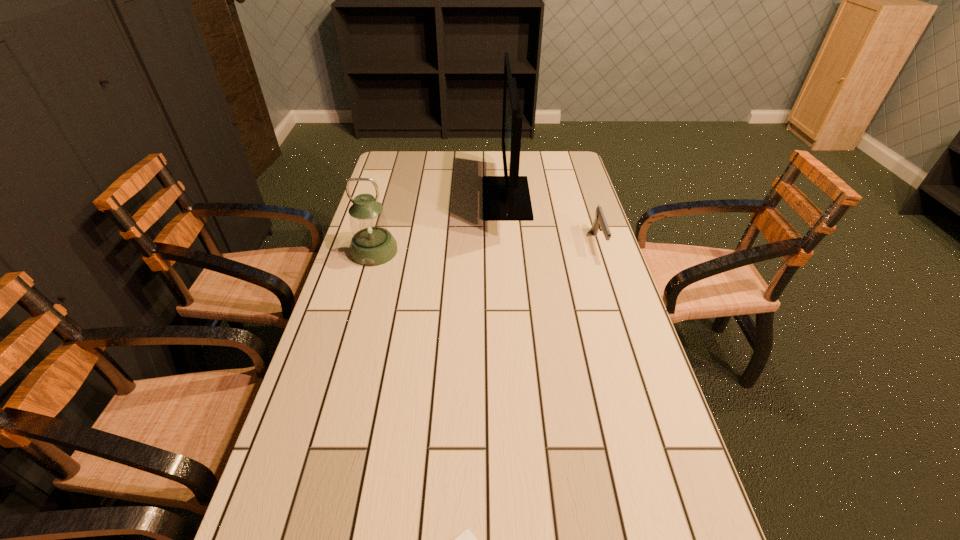
The height and width of the screenshot is (540, 960). I want to click on object that is positioned at the far edge, so click(505, 198).

The width and height of the screenshot is (960, 540). I want to click on object that is at the left edge, so point(372,244).

In order to click on object that is at the right edge in this screenshot , I will do `click(600, 223)`.

This screenshot has width=960, height=540. Identify the location of vacant space at the left edge of the desktop. (312, 504).

In the image, there is a desktop. Identify the location of vacant space at the right edge. The width and height of the screenshot is (960, 540). (561, 224).

This screenshot has height=540, width=960. In the image, there is a desktop. What are the coordinates of `blank space at the far left corner` in the screenshot? It's located at (395, 163).

Find the location of `vacant area at the far right corner`. vacant area at the far right corner is located at coordinates [x=544, y=154].

Where is `vacant space that's between the lantern and the rightmost object`? vacant space that's between the lantern and the rightmost object is located at coordinates (486, 247).

Find the location of a particular element. Image resolution: width=960 pixels, height=540 pixels. vacant point located between the tallest object and the third shortest object is located at coordinates (441, 225).

You are a GUI agent. You are given a task and a screenshot of the screen. Output one action in this format:
    pyautogui.click(x=<x>, y=<y>)
    Task: Click on the unoccupied position between the rightmost object and the third shortest object
    Image resolution: width=960 pixels, height=540 pixels.
    Given the screenshot: What is the action you would take?
    pyautogui.click(x=486, y=247)